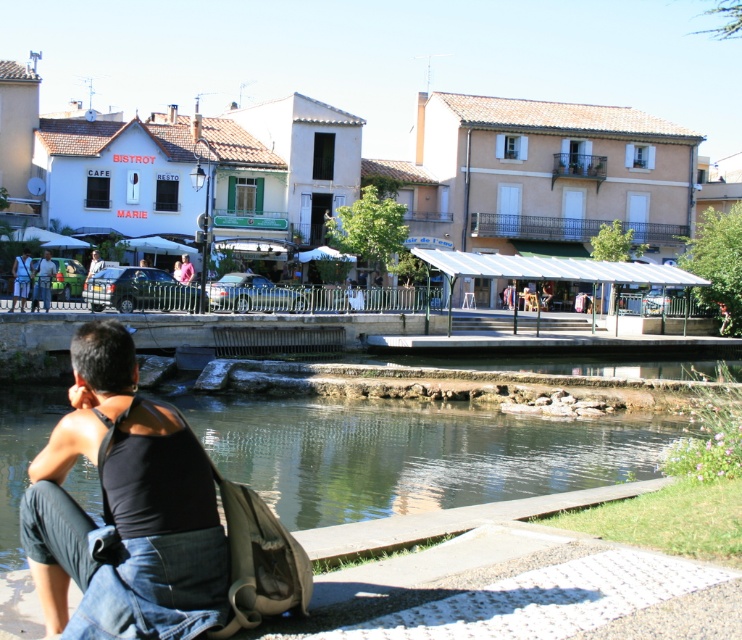
You are standing at the riverside and want to take a photo of the clear water at lower center. According to the coordinates provided, where exactly should you aim your camera?

You should aim your camera at point [413,452] to capture the clear water at lower center.

Based on the photo, you are standing on the paved walkway and want to pick up both the black cotton tank top at lower left and the matte black shirt at lower left. Which one should you reach for first?

You should reach for the black cotton tank top at lower left first because it is closer to you than the matte black shirt at lower left.

You are standing on the paved walkway and see the clear water at lower center and the matte black shirt at left. Which object is located to the right of the other?

The clear water at lower center is to the right of the matte black shirt at left.